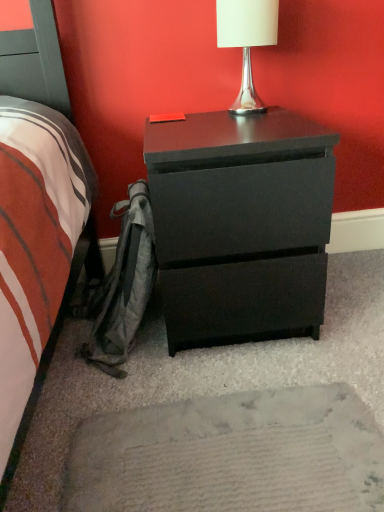
Question: Considering the positions of point (223, 39) and point (241, 264), is point (223, 39) closer or farther from the camera than point (241, 264)?

Choices:
 (A) farther
 (B) closer

Answer: (A)

Question: Looking at the image, does white glossy table lamp at upper center seem bigger or smaller compared to matte black chest of drawers at center?

Choices:
 (A) big
 (B) small

Answer: (B)

Question: In terms of width, does white glossy table lamp at upper center look wider or thinner when compared to matte black chest of drawers at center?

Choices:
 (A) thin
 (B) wide

Answer: (A)

Question: Looking at the image, does matte black chest of drawers at center seem bigger or smaller compared to white glossy table lamp at upper center?

Choices:
 (A) small
 (B) big

Answer: (B)

Question: From their relative heights in the image, would you say matte black chest of drawers at center is taller or shorter than white glossy table lamp at upper center?

Choices:
 (A) short
 (B) tall

Answer: (B)

Question: Is matte black chest of drawers at center in front of or behind white glossy table lamp at upper center in the image?

Choices:
 (A) behind
 (B) front

Answer: (B)

Question: Is matte black chest of drawers at center inside or outside of white glossy table lamp at upper center?

Choices:
 (A) inside
 (B) outside

Answer: (B)